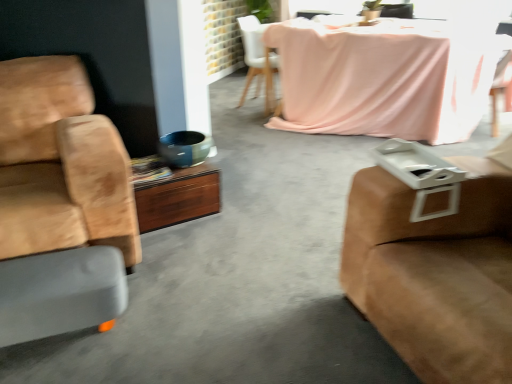
Identify the location of free space that is to the left of suede brown studio couch at right. (270, 310).